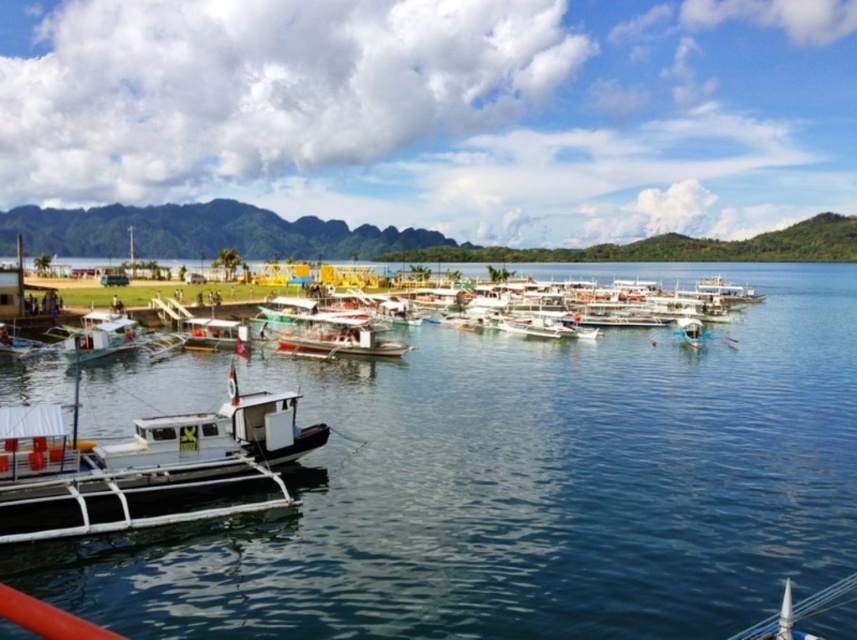
Which of these two, white wooden boat at center or white matte boat at left, stands shorter?

With less height is white wooden boat at center.

Can you confirm if white wooden boat at center is shorter than white matte boat at left?

Yes.

Locate an element on the screen. white wooden boat at center is located at coordinates (337, 337).

Where is `white wooden boat at center`? white wooden boat at center is located at coordinates (337, 337).

Is clear blue water at center above white wooden boat at center?

No, clear blue water at center is not above white wooden boat at center.

Find the location of a particular element. clear blue water at center is located at coordinates (526, 486).

Where is `clear blue water at center`? This screenshot has height=640, width=857. clear blue water at center is located at coordinates (526, 486).

Which is behind, point (424, 365) or point (81, 356)?

The point (424, 365) is more distant.

Is point (764, 330) positioned behind point (73, 333)?

Yes, point (764, 330) is farther from viewer.

What do you see at coordinates (526, 486) in the screenshot?
I see `clear blue water at center` at bounding box center [526, 486].

Where is `clear blue water at center`? This screenshot has height=640, width=857. clear blue water at center is located at coordinates (526, 486).